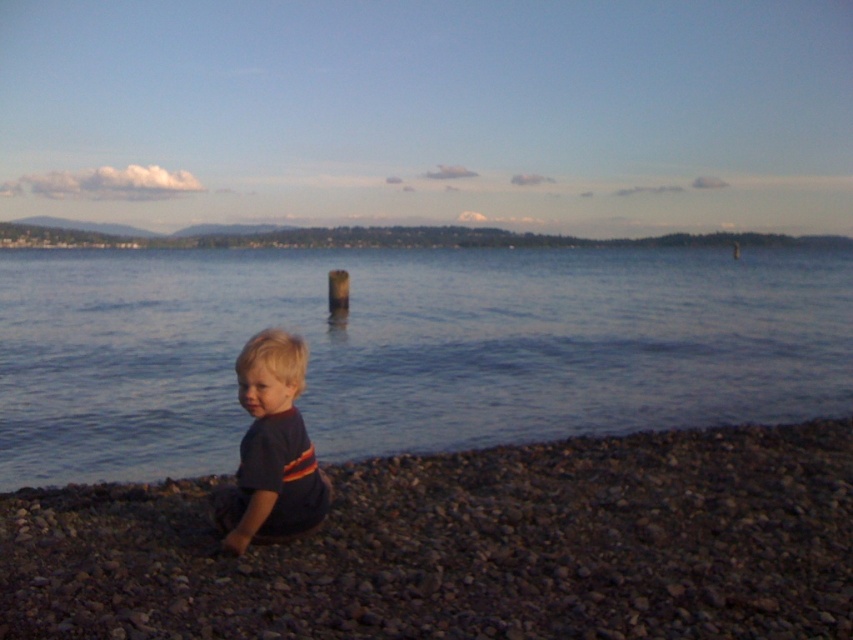
Does blue water at lower left lie behind dark blue t-shirt at lower left?

Yes, blue water at lower left is further from the viewer.

From the picture: Who is positioned more to the left, blue water at lower left or dark blue t-shirt at lower left?

From the viewer's perspective, dark blue t-shirt at lower left appears more on the left side.

Which is behind, point (526, 342) or point (267, 476)?

Positioned behind is point (526, 342).

At what (x,y) coordinates should I click in order to perform the action: click on blue water at lower left. Please return your answer as a coordinate pair (x, y). Image resolution: width=853 pixels, height=640 pixels. Looking at the image, I should click on (405, 349).

Between point (834, 385) and point (759, 531), which one is positioned behind?

The point (834, 385) is behind.

Does blue water at lower left appear under smooth pebble at lower center?

Actually, blue water at lower left is above smooth pebble at lower center.

Between point (346, 438) and point (729, 456), which one is positioned in front?

Point (729, 456) is in front.

Image resolution: width=853 pixels, height=640 pixels. Identify the location of blue water at lower left. (x=405, y=349).

Between point (552, 566) and point (305, 481), which one is positioned behind?

Positioned behind is point (305, 481).

The width and height of the screenshot is (853, 640). What are the coordinates of `smooth pebble at lower center` in the screenshot? It's located at (466, 547).

At what (x,y) coordinates should I click in order to perform the action: click on smooth pebble at lower center. Please return your answer as a coordinate pair (x, y). Looking at the image, I should click on point(466,547).